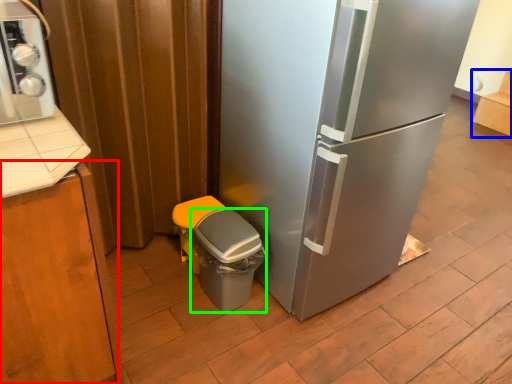
Question: Based on their relative distances, which object is farther from cabinetry (highlighted by a red box)? Choose from cabinetry (highlighted by a blue box) and potty (highlighted by a green box).

Choices:
 (A) cabinetry
 (B) potty

Answer: (A)